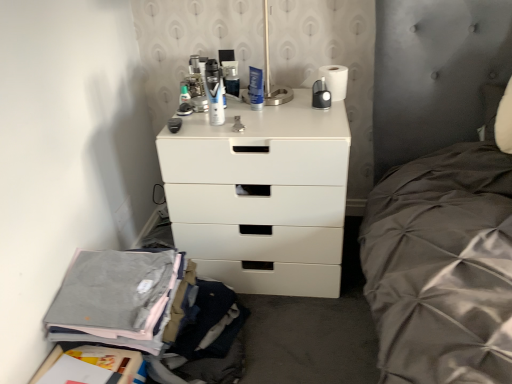
Question: Can you confirm if gray cotton pants at lower left is thinner than translucent plastic toothbrush at upper center, acting as the 2th toiletry starting from the back?

Choices:
 (A) yes
 (B) no

Answer: (B)

Question: Could you tell me if gray cotton pants at lower left is facing translucent plastic toothbrush at upper center, the second toiletry from the front?

Choices:
 (A) yes
 (B) no

Answer: (B)

Question: Does gray cotton pants at lower left contain translucent plastic toothbrush at upper center, acting as the 2th toiletry starting from the back?

Choices:
 (A) no
 (B) yes

Answer: (A)

Question: Is gray cotton pants at lower left positioned in front of translucent plastic toothbrush at upper center, the second toiletry from the front?

Choices:
 (A) no
 (B) yes

Answer: (B)

Question: Is gray cotton pants at lower left not inside translucent plastic toothbrush at upper center, the second toiletry from the front?

Choices:
 (A) no
 (B) yes

Answer: (B)

Question: From the image's perspective, is matte black shaving cream can at center, the 2th toiletry in the right-to-left sequence, positioned above or below metallic silver can at center, the first toiletry from the back?

Choices:
 (A) above
 (B) below

Answer: (B)

Question: In terms of height, does matte black shaving cream can at center, the second toiletry in the left-to-right sequence, look taller or shorter compared to metallic silver can at center, which is counted as the first toiletry, starting from the right?

Choices:
 (A) short
 (B) tall

Answer: (B)

Question: Is point (216, 84) closer or farther from the camera than point (226, 72)?

Choices:
 (A) closer
 (B) farther

Answer: (A)

Question: In the image, is matte black shaving cream can at center, acting as the 3th toiletry starting from the back, on the left side or the right side of metallic silver can at center, which is the third toiletry from front to back?

Choices:
 (A) right
 (B) left

Answer: (B)

Question: In terms of height, does metallic silver can at center, which is counted as the first toiletry, starting from the right, look taller or shorter compared to translucent plastic toothbrush at upper center, the first toiletry positioned from the left?

Choices:
 (A) short
 (B) tall

Answer: (B)

Question: In the image, is metallic silver can at center, the first toiletry from the back, positioned in front of or behind translucent plastic toothbrush at upper center, the third toiletry from the right?

Choices:
 (A) behind
 (B) front

Answer: (A)

Question: In the image, is metallic silver can at center, which is counted as the first toiletry, starting from the right, on the left side or the right side of translucent plastic toothbrush at upper center, acting as the 2th toiletry starting from the back?

Choices:
 (A) left
 (B) right

Answer: (B)

Question: Is point (224, 66) positioned closer to the camera than point (188, 97)?

Choices:
 (A) closer
 (B) farther

Answer: (B)

Question: Is metallic silver can at center, which is the third toiletry in left-to-right order, wider or thinner than gray cotton pants at lower left?

Choices:
 (A) wide
 (B) thin

Answer: (B)

Question: In the image, is metallic silver can at center, which is the third toiletry from front to back, on the left side or the right side of gray cotton pants at lower left?

Choices:
 (A) left
 (B) right

Answer: (B)